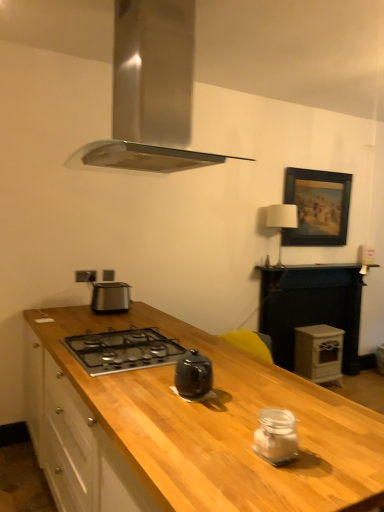
What are the coordinates of `free point behind clear glass jar at center, which is counted as the second kitchen appliance, starting from the left` in the screenshot? It's located at (271, 407).